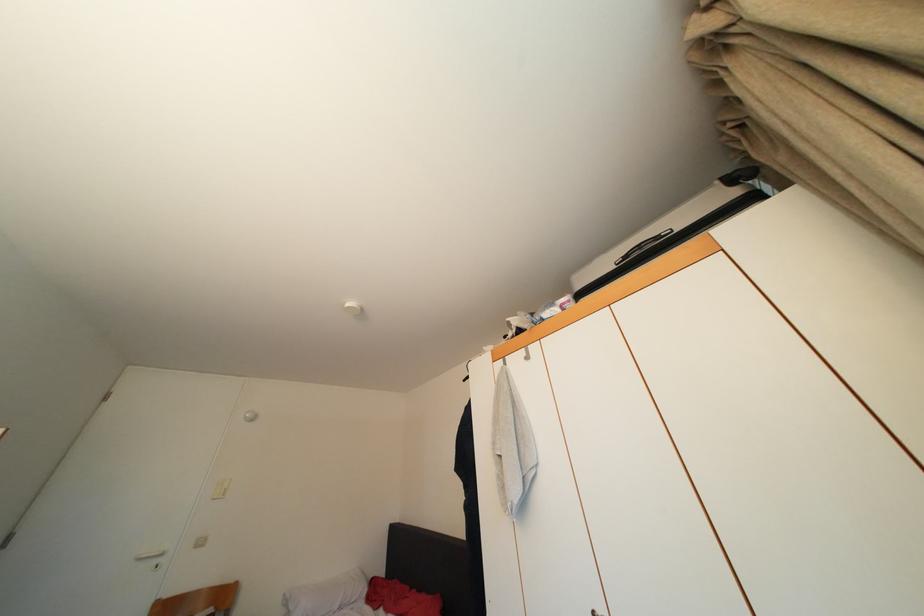
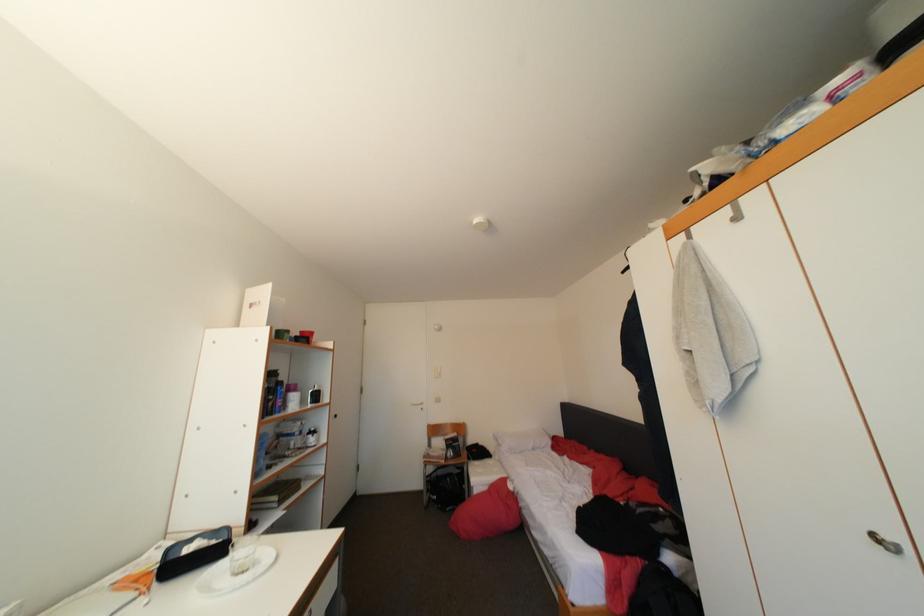
The first image is from the beginning of the video and the second image is from the end. How did the camera likely rotate when shooting the video?

The rotation direction of the camera is left-down.